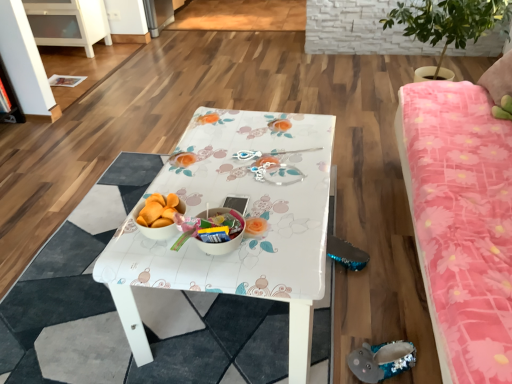
Where is `free area in between pink floral fabric studio couch at right and sequined gray slipper at lower right`? Image resolution: width=512 pixels, height=384 pixels. free area in between pink floral fabric studio couch at right and sequined gray slipper at lower right is located at coordinates tap(379, 259).